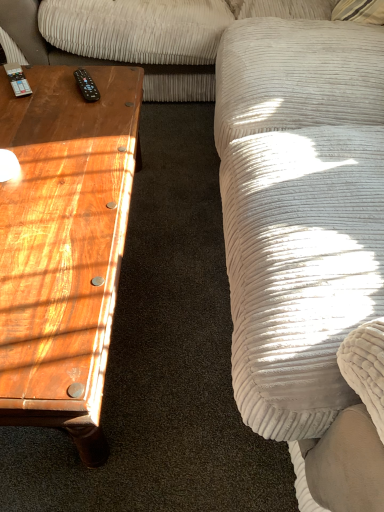
Locate an element on the screen. free space in front of black plastic remote at upper left is located at coordinates pos(74,118).